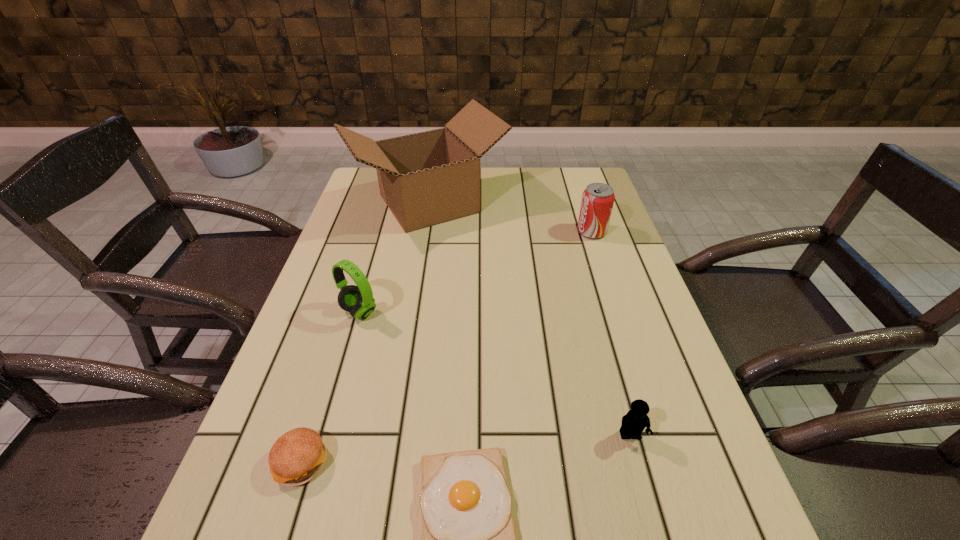
Locate an element on the screen. The height and width of the screenshot is (540, 960). blank region between the box and the third shortest object is located at coordinates (530, 320).

I want to click on vacant space that is in between the headset and the box, so click(x=394, y=258).

Identify which object is the third nearest to the shortest object. Please provide its 2D coordinates. Your answer should be formatted as a tuple, i.e. [(x, y)], where the tuple contains the x and y coordinates of a point satisfying the conditions above.

[(358, 300)]

Locate which object ranks in proximity to the soda can. Please provide its 2D coordinates. Your answer should be formatted as a tuple, i.e. [(x, y)], where the tuple contains the x and y coordinates of a point satisfying the conditions above.

[(428, 178)]